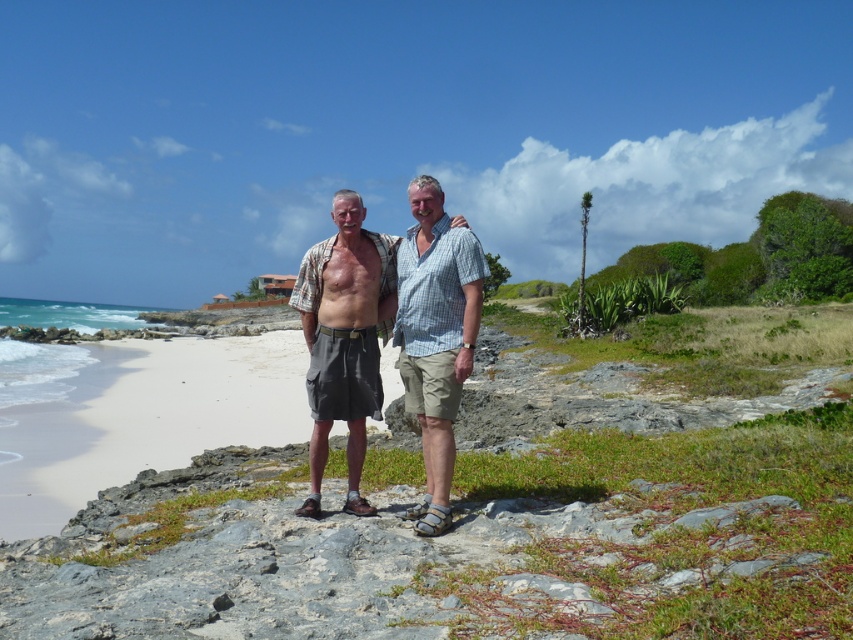
Question: Which object is the closest to the matte khaki shorts at center?

Choices:
 (A) checkered fabric shirt at center
 (B) white sand beach at center

Answer: (A)

Question: Does matte khaki shorts at center appear under checkered fabric shirt at center?

Choices:
 (A) yes
 (B) no

Answer: (B)

Question: Can you confirm if white sand beach at center is thinner than checkered fabric shirt at center?

Choices:
 (A) no
 (B) yes

Answer: (A)

Question: Which is farther from the checkered fabric shirt at center?

Choices:
 (A) white sand beach at center
 (B) matte khaki shorts at center

Answer: (A)

Question: Can you confirm if matte khaki shorts at center is bigger than checkered fabric shirt at center?

Choices:
 (A) yes
 (B) no

Answer: (B)

Question: Among these objects, which one is farthest from the camera?

Choices:
 (A) checkered fabric shirt at center
 (B) matte khaki shorts at center

Answer: (B)